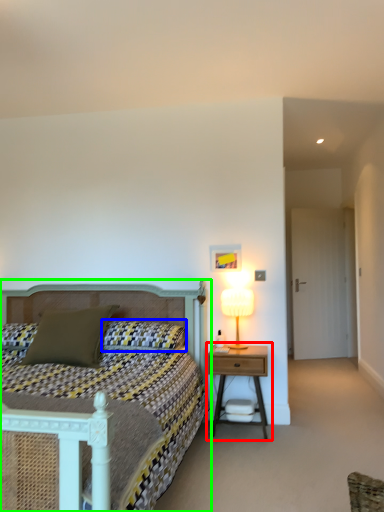
Question: Considering the real-world distances, which object is closest to nightstand (highlighted by a red box)? pillow (highlighted by a blue box) or bed (highlighted by a green box).

Choices:
 (A) pillow
 (B) bed

Answer: (A)